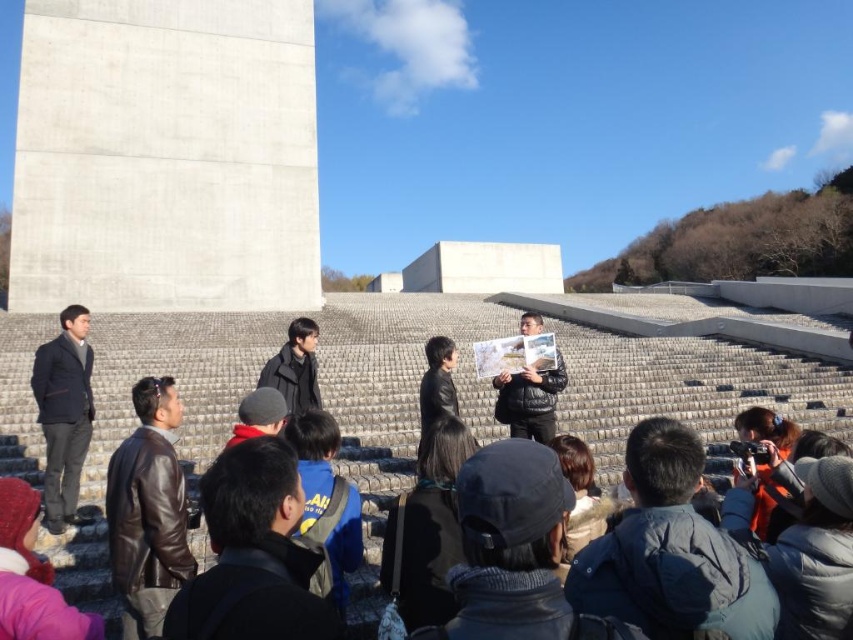
You are a photographer trying to capture a photo of the black leather hat at center and the leather jacket at lower center. You want to ensure both items are clearly visible in your shot. Which object should you focus on first to ensure proper framing, considering their sizes?

The black leather hat at center is wider than the leather jacket at lower center, so focusing on the black leather hat at center first will help ensure proper framing for both items.

You are a photographer trying to capture a clear shot of the black leather hat at center and the leather jacket at lower center. Since you want both subjects to be in focus, you need to adjust your camera settings. Considering their heights, which object should you focus on first to ensure proper depth of field?

The black leather hat at center is much taller than the leather jacket at lower center, so you should focus on the black leather hat at center first to ensure both are in focus.

You are a photographer trying to capture a clear shot of the blue fabric jacket at center without the black leather backpack at center blocking it. How should you adjust your position?

Move to the left side so that the blue fabric jacket at center is positioned to the right of the black leather backpack at center, ensuring the backpack does not obstruct the jacket.